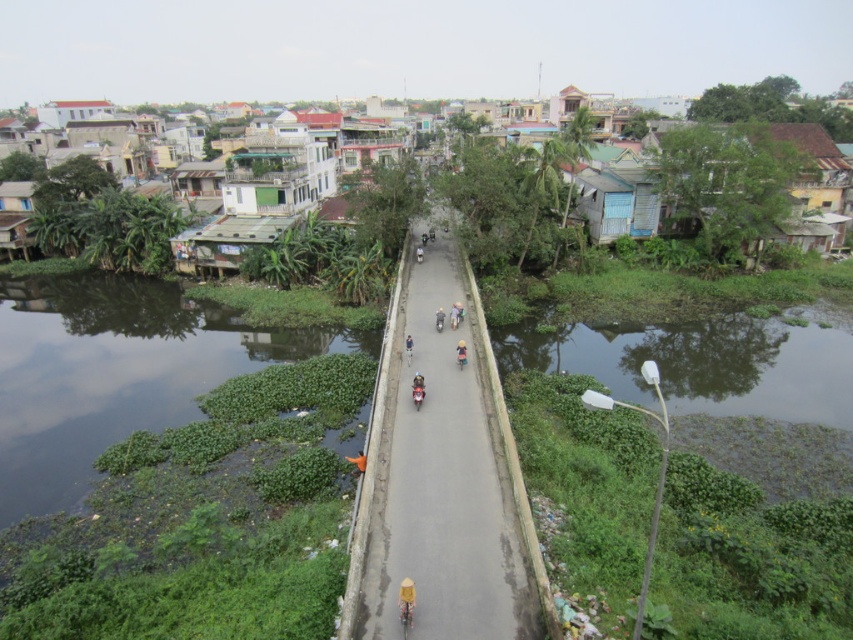
Question: Which point appears closest to the camera in this image?

Choices:
 (A) (744, 413)
 (B) (412, 598)
 (C) (111, 438)

Answer: (B)

Question: Does green algae-covered water at lower right have a smaller size compared to orange fabric at center?

Choices:
 (A) no
 (B) yes

Answer: (A)

Question: Is the position of yellow straw hat at center more distant than that of blue fabric bicycle at center?

Choices:
 (A) no
 (B) yes

Answer: (A)

Question: Which point is farther to the camera?

Choices:
 (A) orange fabric at center
 (B) blue fabric bicycle at center

Answer: (B)

Question: Does green algae-covered water at lower right have a larger size compared to blue fabric bicycle at center?

Choices:
 (A) no
 (B) yes

Answer: (B)

Question: Which object is the closest to the green algae-covered water at lower right?

Choices:
 (A) blue fabric bicycle at center
 (B) orange fabric at center
 (C) green algae at lower left
 (D) yellow straw hat at center

Answer: (A)